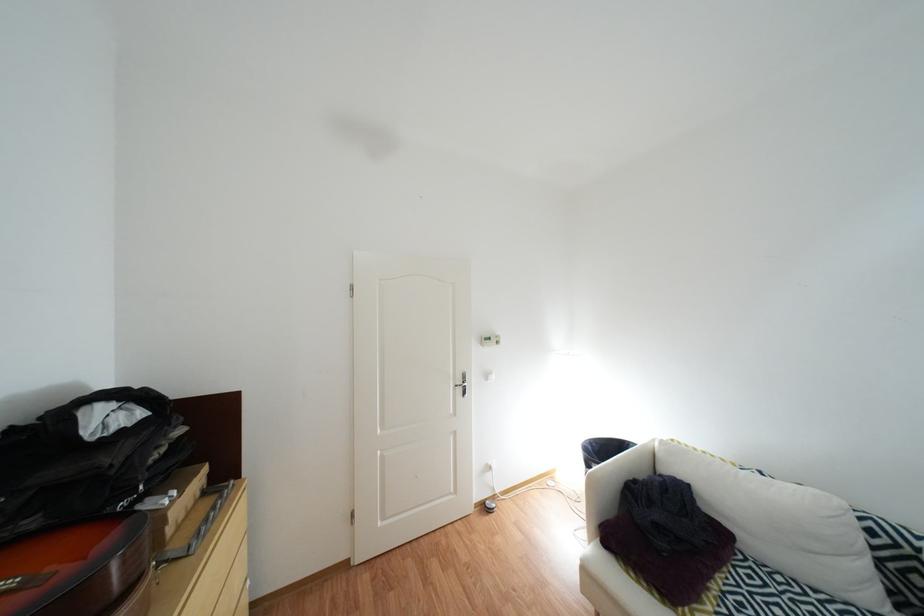
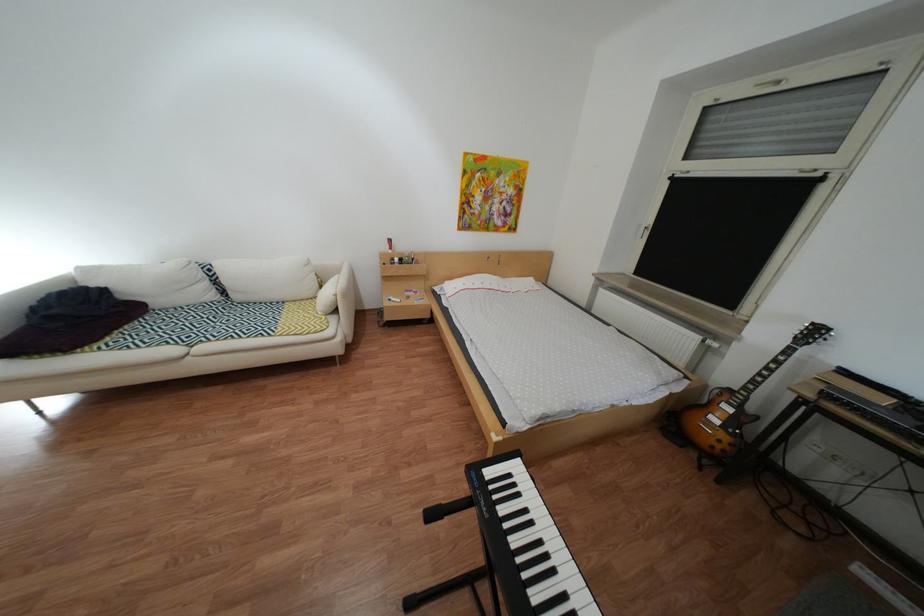
Find the pixel in the second image that matches pixel 883 562 in the first image.

(223, 284)